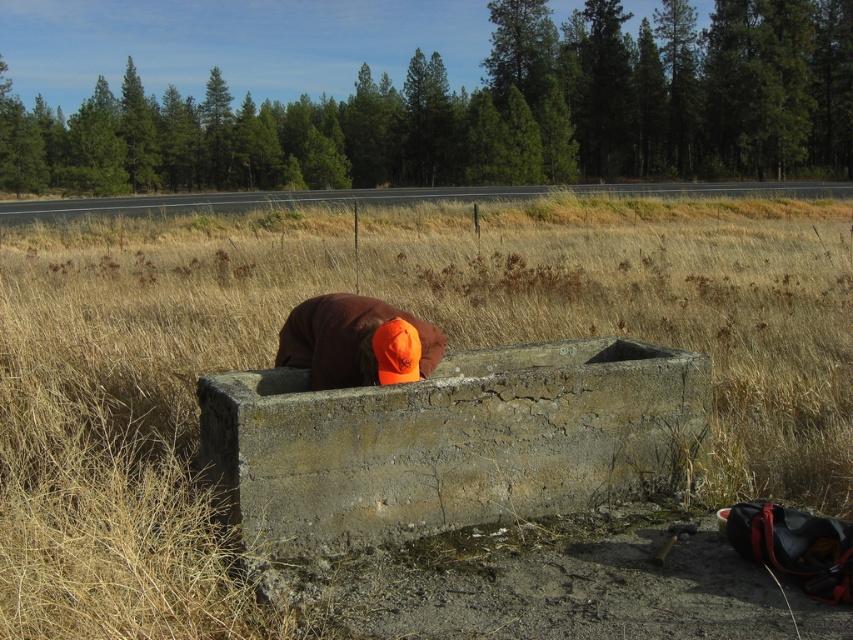
Is dry grass at center closer to camera compared to gray concrete trough at center?

Yes, it is.

Between dry grass at center and gray concrete trough at center, which one has less height?

With less height is gray concrete trough at center.

Which is behind, point (80, 477) or point (264, 513)?

Point (80, 477)

At what (x,y) coordinates should I click in order to perform the action: click on dry grass at center. Please return your answer as a coordinate pair (x, y). The height and width of the screenshot is (640, 853). Looking at the image, I should click on (136, 412).

Where is `dry grass at center`? This screenshot has height=640, width=853. dry grass at center is located at coordinates (136, 412).

What do you see at coordinates (136, 412) in the screenshot? The width and height of the screenshot is (853, 640). I see `dry grass at center` at bounding box center [136, 412].

Between point (170, 540) and point (294, 316), which one is positioned behind?

The point (294, 316) is more distant.

The height and width of the screenshot is (640, 853). What are the coordinates of `dry grass at center` in the screenshot? It's located at (136, 412).

Looking at this image, which is more to the right, gray concrete trough at center or brown fuzzy hat at center?

gray concrete trough at center is more to the right.

Can you confirm if gray concrete trough at center is positioned to the right of brown fuzzy hat at center?

Indeed, gray concrete trough at center is positioned on the right side of brown fuzzy hat at center.

What do you see at coordinates (447, 442) in the screenshot?
I see `gray concrete trough at center` at bounding box center [447, 442].

Find the location of a particular element. This screenshot has height=640, width=853. gray concrete trough at center is located at coordinates pyautogui.click(x=447, y=442).